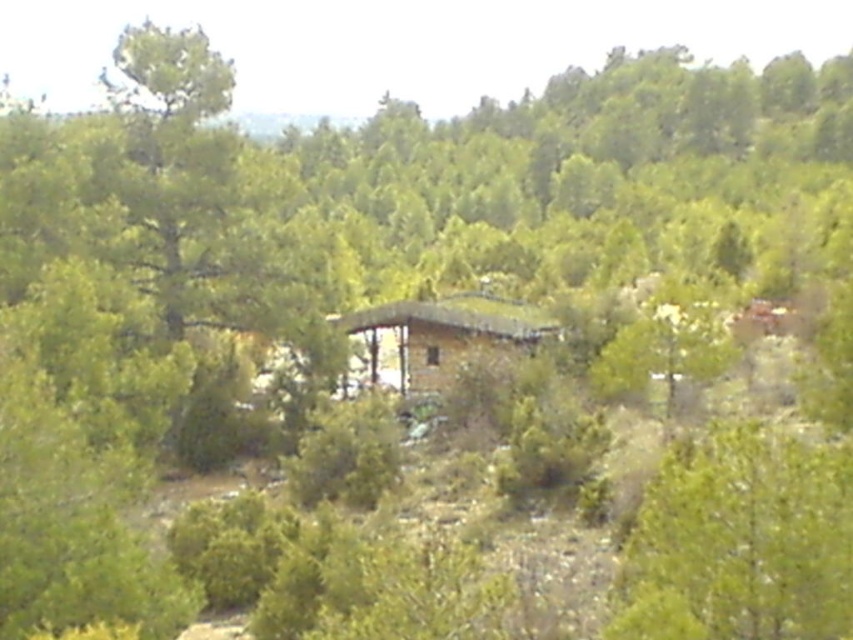
You are standing in front of the rustic structure and want to determine the relative positions of two points marked on the ground. Which point is nearer to you, point [821,520] or point [408,346]?

Point [821,520] is closer to the viewer than point [408,346].

You are standing outside the wooden cabin at center and want to see the green leafy tree at lower right. Is the tree taller or shorter than the cabin?

The green leafy tree at lower right is shorter than the wooden cabin at center.